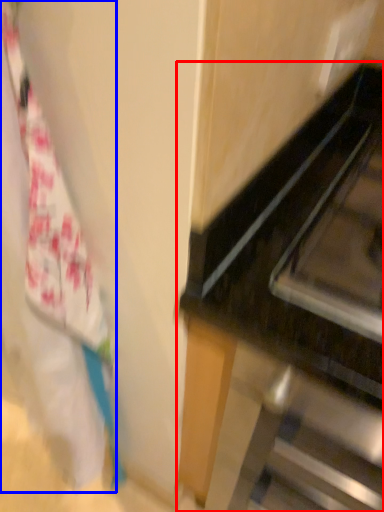
Question: Which object is further to the camera taking this photo, furniture (highlighted by a red box) or laundry (highlighted by a blue box)?

Choices:
 (A) furniture
 (B) laundry

Answer: (A)